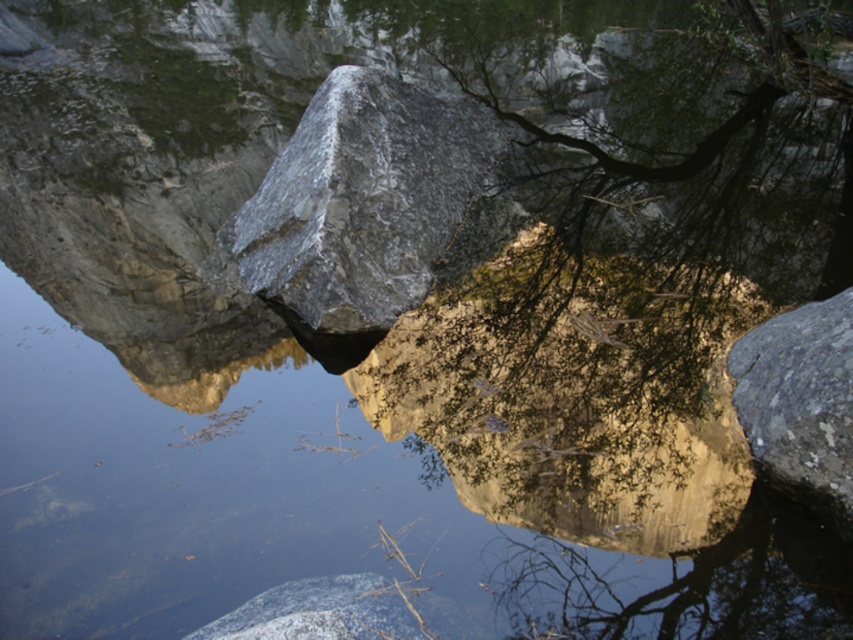
Does green leafy tree at center have a greater height compared to gray rough rock at right?

Correct, green leafy tree at center is much taller as gray rough rock at right.

Describe the element at coordinates (621, 300) in the screenshot. I see `green leafy tree at center` at that location.

Is point (518, 278) farther from camera compared to point (775, 470)?

That is True.

Locate an element on the screen. The width and height of the screenshot is (853, 640). green leafy tree at center is located at coordinates (621, 300).

Does green leafy tree at center have a greater height compared to gray/rough rock at lower center?

Yes.

Who is lower down, green leafy tree at center or gray/rough rock at lower center?

gray/rough rock at lower center is lower down.

Which is in front, point (645, 371) or point (358, 634)?

Point (358, 634)

The height and width of the screenshot is (640, 853). Identify the location of green leafy tree at center. (621, 300).

Is gray rough rock at right shorter than gray/rough rock at lower center?

No, gray rough rock at right is not shorter than gray/rough rock at lower center.

Which is more to the left, gray rough rock at right or gray/rough rock at lower center?

From the viewer's perspective, gray/rough rock at lower center appears more on the left side.

Describe the element at coordinates (801, 401) in the screenshot. I see `gray rough rock at right` at that location.

Identify the location of gray rough rock at right. Image resolution: width=853 pixels, height=640 pixels. (801, 401).